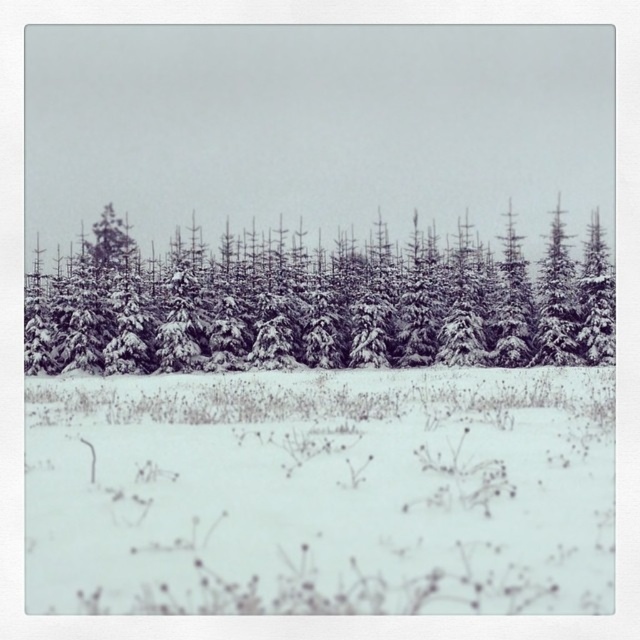
You are standing in the winter forest and want to step onto the white fluffy snow at center. Based on the coordinates provided, is the snow at center directly in front of you or to one side?

The white fluffy snow at center is located at point coordinates, so it is directly in front of you.

You are standing in the winter forest scene described. You notice a specific point marked at coordinates (321, 492). What is located at this point?

The point at coordinates (321, 492) marks white fluffy snow at center.